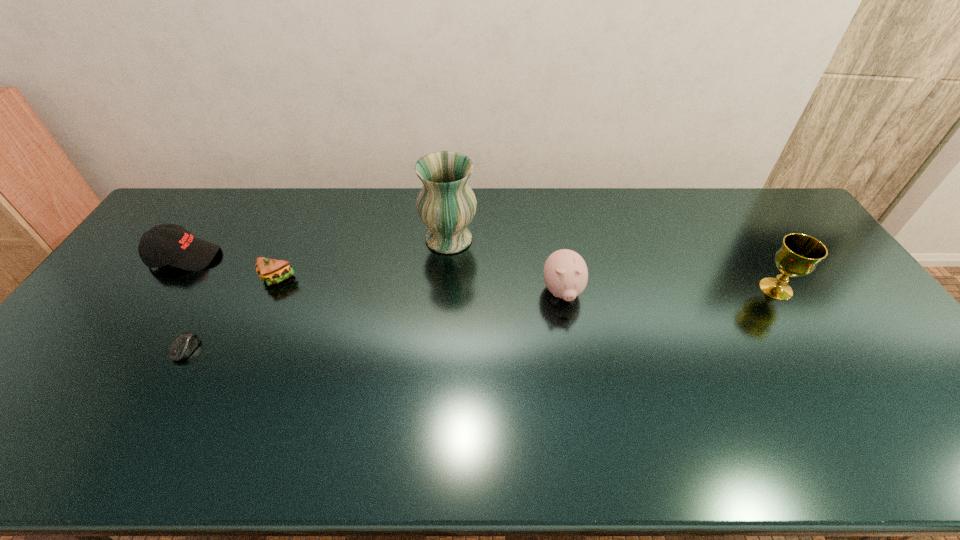
Where is `vacant space that's between the vase and the second object from left to right`? Image resolution: width=960 pixels, height=540 pixels. vacant space that's between the vase and the second object from left to right is located at coordinates click(x=318, y=294).

Where is `vacant region between the chalice and the baseball cap`? This screenshot has height=540, width=960. vacant region between the chalice and the baseball cap is located at coordinates (480, 273).

At what (x,y) coordinates should I click in order to perform the action: click on free area in between the sandwich and the chalice. Please return your answer as a coordinate pair (x, y). The image size is (960, 540). Looking at the image, I should click on (526, 284).

Where is `empty space that is in between the third object from left to right and the vase`? This screenshot has width=960, height=540. empty space that is in between the third object from left to right and the vase is located at coordinates (363, 259).

Where is `object that is the fifth closest to the fourth object from right to left`? This screenshot has width=960, height=540. object that is the fifth closest to the fourth object from right to left is located at coordinates (799, 255).

Image resolution: width=960 pixels, height=540 pixels. In order to click on the fifth closest object to the fifth object from left to right in this screenshot , I will do `click(167, 244)`.

Find the location of `vacant space that satisfies the following two spatial constraints: 1. on the front-facing side of the leftmost object; 2. on the right side of the chalice`. vacant space that satisfies the following two spatial constraints: 1. on the front-facing side of the leftmost object; 2. on the right side of the chalice is located at coordinates (163, 289).

The image size is (960, 540). I want to click on free space that satisfies the following two spatial constraints: 1. on the front-facing side of the sandwich; 2. on the right side of the fourth tallest object, so click(x=170, y=279).

This screenshot has height=540, width=960. I want to click on vacant space that satisfies the following two spatial constraints: 1. on the front-facing side of the mouse; 2. on the right side of the third shortest object, so click(x=122, y=349).

You are a GUI agent. You are given a task and a screenshot of the screen. Output one action in this format:
    pyautogui.click(x=<x>, y=<y>)
    Task: Click on the free location that satisfies the following two spatial constraints: 1. on the front-facing side of the leftmost object; 2. on the right side of the third object from left to right
    This screenshot has width=960, height=540.
    Given the screenshot: What is the action you would take?
    pyautogui.click(x=170, y=279)